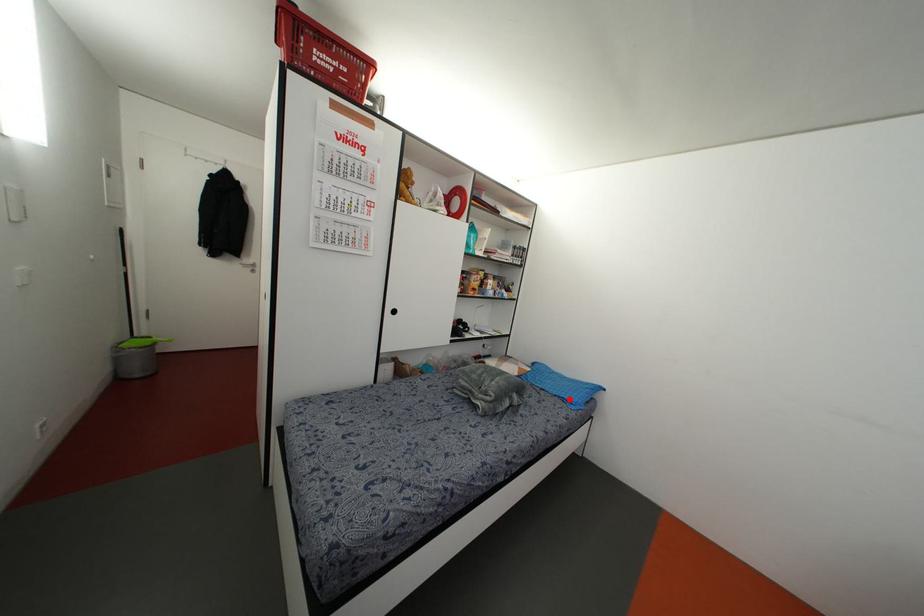
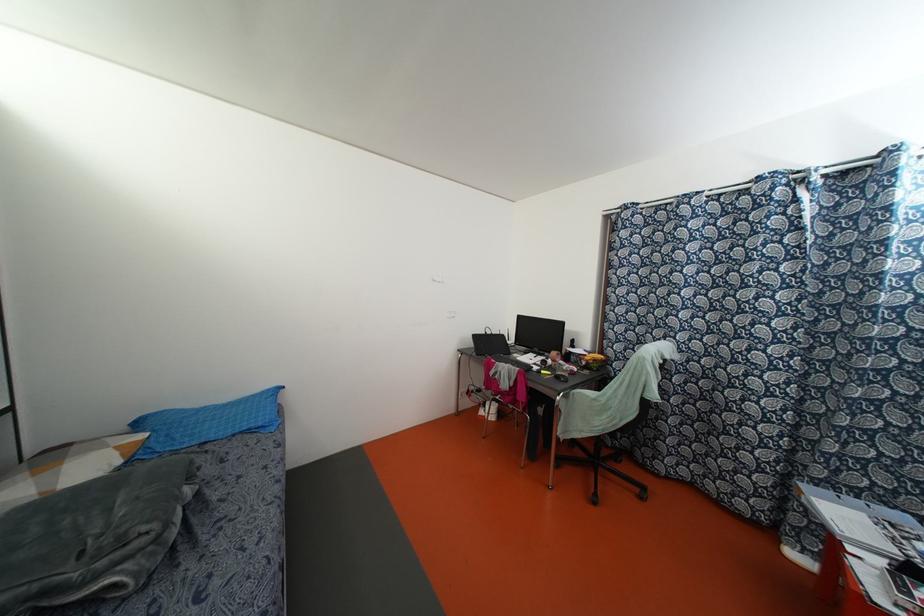
Question: I am providing you with two images of the same scene from different viewpoints. In image1, a red point is highlighted. Considering the same 3D point in image2, which of the following is correct?

Choices:
 (A) It is closer
 (B) It is farther

Answer: (A)